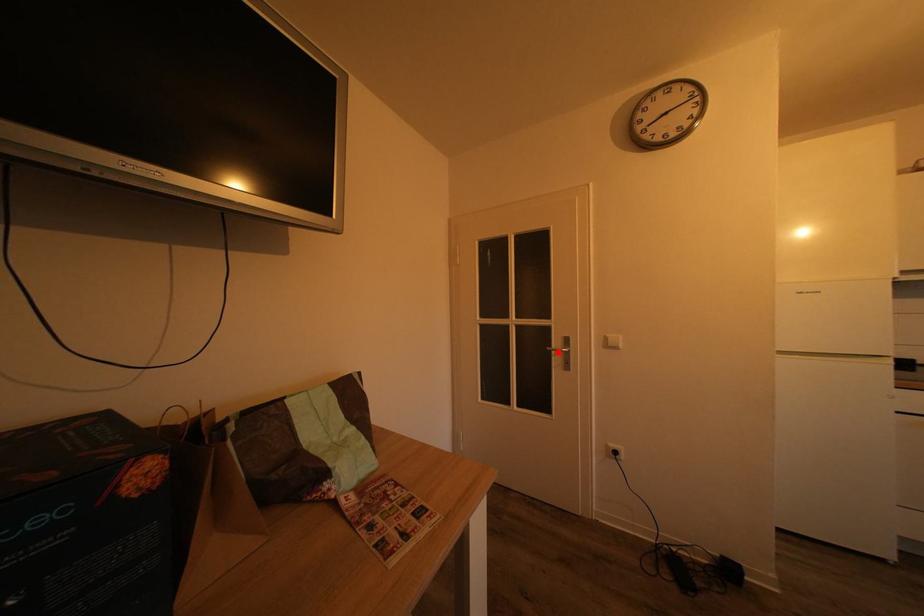
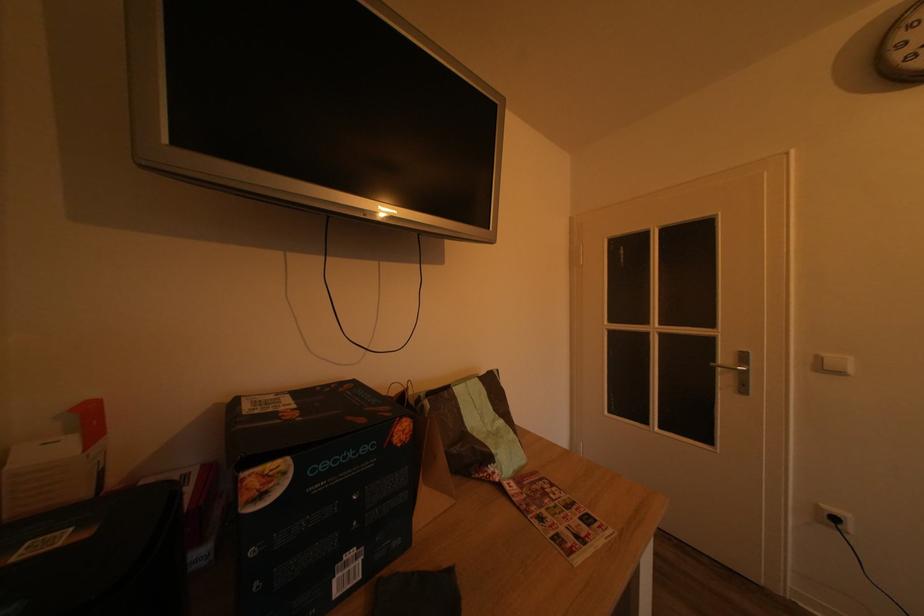
The point at the highlighted location is marked in the first image. Where is the corresponding point in the second image?

(723, 368)